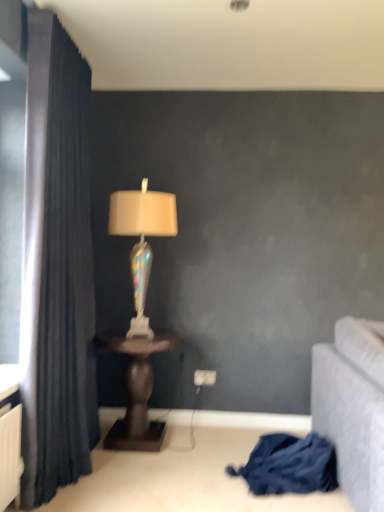
Describe the element at coordinates (290, 465) in the screenshot. I see `blue fabric at lower right` at that location.

Where is `dark blue fabric curtain at left`? dark blue fabric curtain at left is located at coordinates (56, 267).

Considering the sizes of objects dark blue fabric curtain at left and blue fabric at lower right in the image provided, who is thinner, dark blue fabric curtain at left or blue fabric at lower right?

With smaller width is dark blue fabric curtain at left.

Is dark blue fabric curtain at left positioned behind blue fabric at lower right?

No, dark blue fabric curtain at left is closer to the camera.

What's the angular difference between dark blue fabric curtain at left and blue fabric at lower right's facing directions?

dark blue fabric curtain at left and blue fabric at lower right are facing 76.1 degrees away from each other.

Is brown wooden table at center oriented away from iridescent glass lamp at center?

No.

Considering the positions of objects brown wooden table at center and iridescent glass lamp at center in the image provided, who is in front, brown wooden table at center or iridescent glass lamp at center?

brown wooden table at center is in front.

From a real-world perspective, between brown wooden table at center and iridescent glass lamp at center, who is vertically lower?

From a 3D spatial view, brown wooden table at center is below.

Could iridescent glass lamp at center be considered to be inside brown wooden table at center?

No, iridescent glass lamp at center is not a part of brown wooden table at center.

From the image's perspective, which is above, brown wooden table at center or blue fabric at lower right?

brown wooden table at center.

Is brown wooden table at center positioned beyond the bounds of blue fabric at lower right?

brown wooden table at center is positioned outside blue fabric at lower right.

In terms of width, does brown wooden table at center look wider or thinner when compared to blue fabric at lower right?

Clearly, brown wooden table at center has more width compared to blue fabric at lower right.

Considering the relative positions of brown wooden table at center and blue fabric at lower right in the image provided, is brown wooden table at center to the left or to the right of blue fabric at lower right?

From the image, it's evident that brown wooden table at center is to the left of blue fabric at lower right.

From the image's perspective, is dark blue fabric curtain at left located above or below brown wooden table at center?

Clearly, from the image's perspective, dark blue fabric curtain at left is above brown wooden table at center.

Could you tell me if dark blue fabric curtain at left is facing brown wooden table at center?

Yes, dark blue fabric curtain at left faces towards brown wooden table at center.

In terms of height, does dark blue fabric curtain at left look taller or shorter compared to brown wooden table at center?

Considering their sizes, dark blue fabric curtain at left has more height than brown wooden table at center.

Between dark blue fabric curtain at left and brown wooden table at center, which one has smaller size?

Smaller between the two is brown wooden table at center.

Measure the distance from iridescent glass lamp at center to brown wooden table at center.

iridescent glass lamp at center and brown wooden table at center are 18.83 inches apart from each other.

From the image's perspective, which one is positioned higher, iridescent glass lamp at center or brown wooden table at center?

iridescent glass lamp at center, from the image's perspective.

Is brown wooden table at center located within iridescent glass lamp at center?

No, brown wooden table at center is not a part of iridescent glass lamp at center.

Between point (171, 230) and point (118, 449), which one is positioned behind?

Point (171, 230)

Is the depth of iridescent glass lamp at center less than that of blue fabric at lower right?

No, iridescent glass lamp at center is further to the viewer.

Where is `blanket on the right of iridescent glass lamp at center`? blanket on the right of iridescent glass lamp at center is located at coordinates (290, 465).

Is blue fabric at lower right at the back of iridescent glass lamp at center?

iridescent glass lamp at center is not turned away from blue fabric at lower right.

Could blue fabric at lower right be considered to be inside iridescent glass lamp at center?

No.

In terms of size, does brown wooden table at center appear bigger or smaller than dark blue fabric curtain at left?

brown wooden table at center is smaller than dark blue fabric curtain at left.

Is brown wooden table at center facing away from dark blue fabric curtain at left?

No, brown wooden table at center is not facing away from dark blue fabric curtain at left.

From a real-world perspective, which is physically above, brown wooden table at center or dark blue fabric curtain at left?

dark blue fabric curtain at left is physically above.

Image resolution: width=384 pixels, height=512 pixels. Find the location of `curtain in front of the blue fabric at lower right`. curtain in front of the blue fabric at lower right is located at coordinates (56, 267).

Identify the location of lamp that appears on the left of brown wooden table at center. Image resolution: width=384 pixels, height=512 pixels. (142, 240).

From the image, which object appears to be nearer to dark blue fabric curtain at left, blue fabric at lower right or brown wooden table at center?

Based on the image, brown wooden table at center appears to be nearer to dark blue fabric curtain at left.

From the image, which object appears to be farther from iridescent glass lamp at center, brown wooden table at center or dark blue fabric curtain at left?

dark blue fabric curtain at left is positioned further to the anchor iridescent glass lamp at center.

Considering their positions, is blue fabric at lower right positioned closer to brown wooden table at center than dark blue fabric curtain at left?

dark blue fabric curtain at left is positioned closer to the anchor brown wooden table at center.

Estimate the real-world distances between objects in this image. Which object is closer to blue fabric at lower right, dark blue fabric curtain at left or brown wooden table at center?

brown wooden table at center lies closer to blue fabric at lower right than the other object.

Which object lies nearer to the anchor point dark blue fabric curtain at left, blue fabric at lower right or iridescent glass lamp at center?

Among the two, iridescent glass lamp at center is located nearer to dark blue fabric curtain at left.

Which object lies further to the anchor point dark blue fabric curtain at left, iridescent glass lamp at center or blue fabric at lower right?

Among the two, blue fabric at lower right is located further to dark blue fabric curtain at left.

From the image, which object appears to be farther from iridescent glass lamp at center, dark blue fabric curtain at left or brown wooden table at center?

The object further to iridescent glass lamp at center is dark blue fabric curtain at left.

Considering their positions, is blue fabric at lower right positioned further to brown wooden table at center than iridescent glass lamp at center?

blue fabric at lower right is positioned further to the anchor brown wooden table at center.

Where is `table between dark blue fabric curtain at left and blue fabric at lower right in the horizontal direction`? table between dark blue fabric curtain at left and blue fabric at lower right in the horizontal direction is located at coordinates (137, 390).

At what (x,y) coordinates should I click in order to perform the action: click on curtain that lies between iridescent glass lamp at center and brown wooden table at center from top to bottom. Please return your answer as a coordinate pair (x, y). Looking at the image, I should click on (56, 267).

The image size is (384, 512). In order to click on table between iridescent glass lamp at center and blue fabric at lower right from top to bottom in this screenshot , I will do `click(137, 390)`.

Find the location of a particular element. This screenshot has width=384, height=512. curtain between iridescent glass lamp at center and blue fabric at lower right from top to bottom is located at coordinates (56, 267).